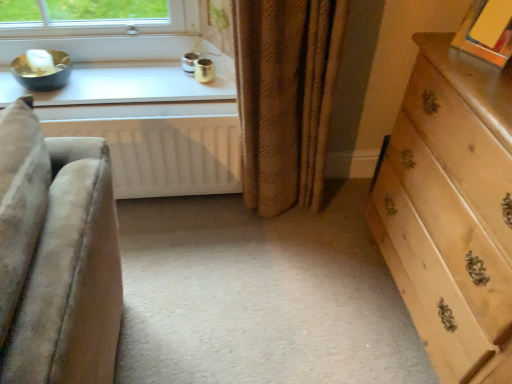
Where is `free spot in front of brown textured curtain at center`? free spot in front of brown textured curtain at center is located at coordinates (266, 261).